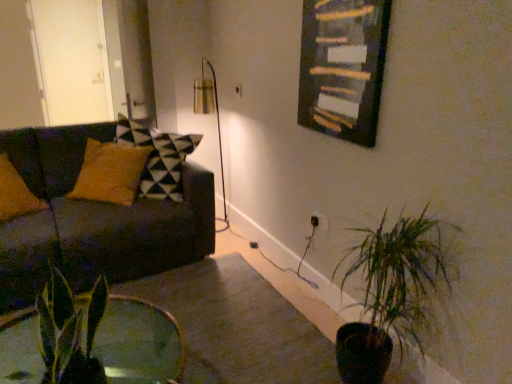
Question: Considering the positions of white glossy door at upper left and green glossy leaf at lower left, marked as the 1th houseplant in a front-to-back arrangement, in the image, is white glossy door at upper left taller or shorter than green glossy leaf at lower left, marked as the 1th houseplant in a front-to-back arrangement,?

Choices:
 (A) short
 (B) tall

Answer: (B)

Question: Is white glossy door at upper left bigger or smaller than green glossy leaf at lower left, which appears as the 2th houseplant when viewed from the back?

Choices:
 (A) big
 (B) small

Answer: (A)

Question: Estimate the real-world distances between objects in this image. Which object is closer to the green leafy plant at lower right, placed as the 2th houseplant when sorted from left to right?

Choices:
 (A) green glossy leaf at lower left, the 1th houseplant positioned from the left
 (B) dark brown fabric couch at left
 (C) metallic gold table lamp at center
 (D) wooden frame at upper center
 (E) white glossy door at upper left

Answer: (D)

Question: Which object is the closest to the green glossy leaf at lower left, marked as the 1th houseplant in a front-to-back arrangement?

Choices:
 (A) dark brown fabric couch at left
 (B) white glossy door at upper left
 (C) metallic gold table lamp at center
 (D) wooden frame at upper center
 (E) green leafy plant at lower right, arranged as the 2th houseplant when viewed from the front

Answer: (E)